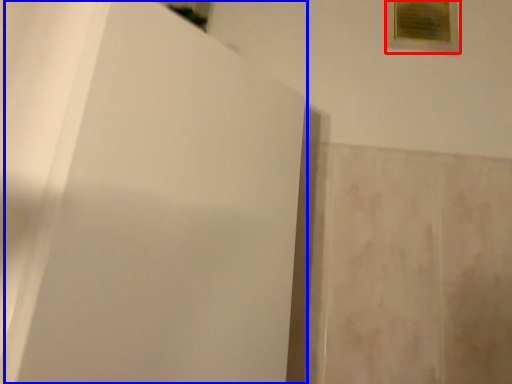
Question: Which object appears farthest to the camera in this image, picture frame (highlighted by a red box) or screen door (highlighted by a blue box)?

Choices:
 (A) picture frame
 (B) screen door

Answer: (A)